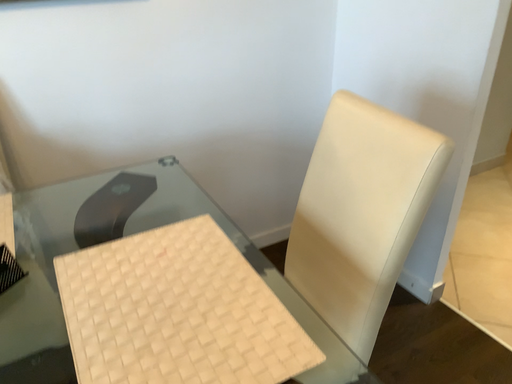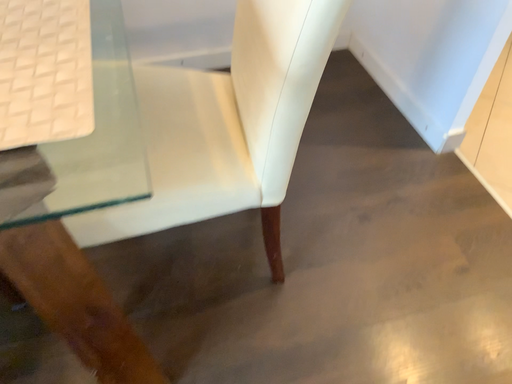
Question: Which way did the camera rotate in the video?

Choices:
 (A) rotated downward
 (B) rotated upward

Answer: (A)